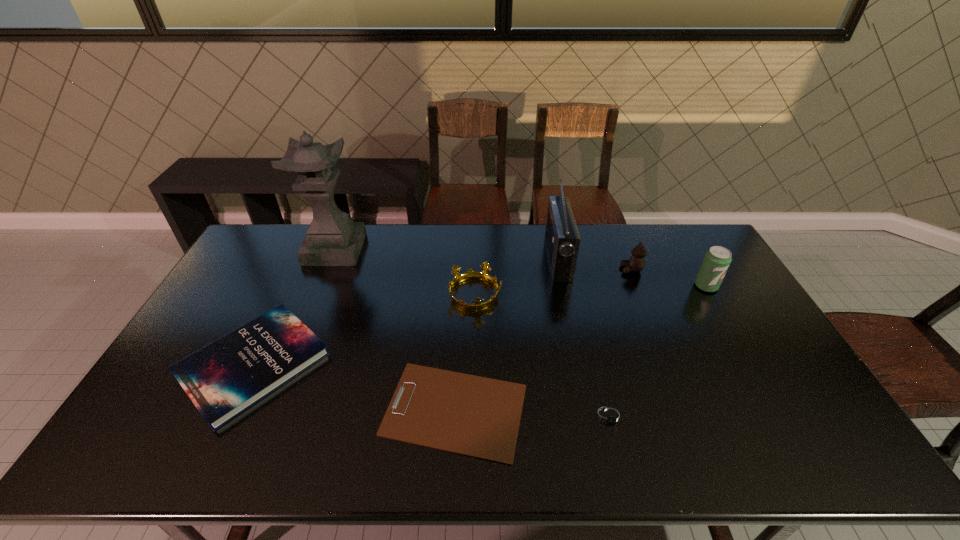
Where is `the tallest object`? The image size is (960, 540). the tallest object is located at coordinates (333, 239).

In order to click on radio receiver in this screenshot , I will do `click(562, 238)`.

At what (x,y) coordinates should I click in order to perform the action: click on the sixth shortest object. Please return your answer as a coordinate pair (x, y). The image size is (960, 540). Looking at the image, I should click on (717, 259).

This screenshot has height=540, width=960. Find the location of `soda`. soda is located at coordinates (717, 259).

Find the location of `the fourth tallest object`. the fourth tallest object is located at coordinates (636, 263).

Find the location of a particular element. This screenshot has height=540, width=960. the second object from right to left is located at coordinates (636, 263).

This screenshot has width=960, height=540. I want to click on crown, so click(484, 276).

This screenshot has height=540, width=960. Find the location of `hardback book`. hardback book is located at coordinates coord(223,379).

The image size is (960, 540). Identify the location of the second shortest object. point(609,416).

This screenshot has height=540, width=960. What are the coordinates of `clipboard` in the screenshot? It's located at (475, 416).